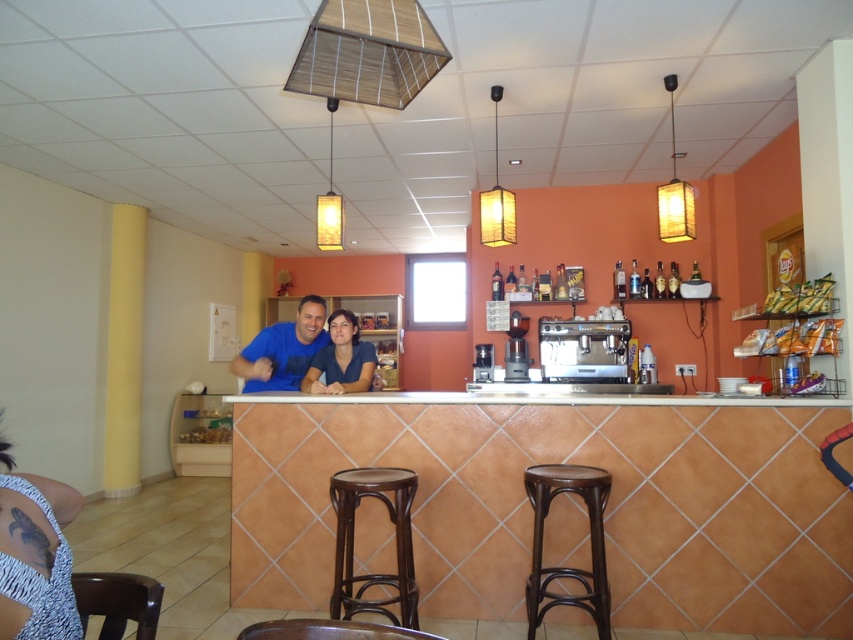
You are a customer at the cafe and need to choose seating. The brown wood stool at center and the brown wood bar stool at lower right are available. Which one is taller?

The brown wood stool at center is taller than the brown wood bar stool at lower right.

You are a customer at the cafe and want to grab both the blue textured dress at lower left and the blue fabric shirt at center. However, you can only reach items that are to your right. Which item should you try to reach first?

The blue fabric shirt at center is to the left of the blue textured dress at lower left. Since you can only reach items to your right, you should first try to reach the blue fabric shirt at center and then the blue textured dress at lower left.

You are a customer in the cafe and want to pick up both the blue textured dress at lower left and the blue fabric shirt at center. Which item should you reach for first if you want to grab the lower one first?

The blue textured dress at lower left is located below the blue fabric shirt at center, so you should reach for the blue textured dress at lower left first.